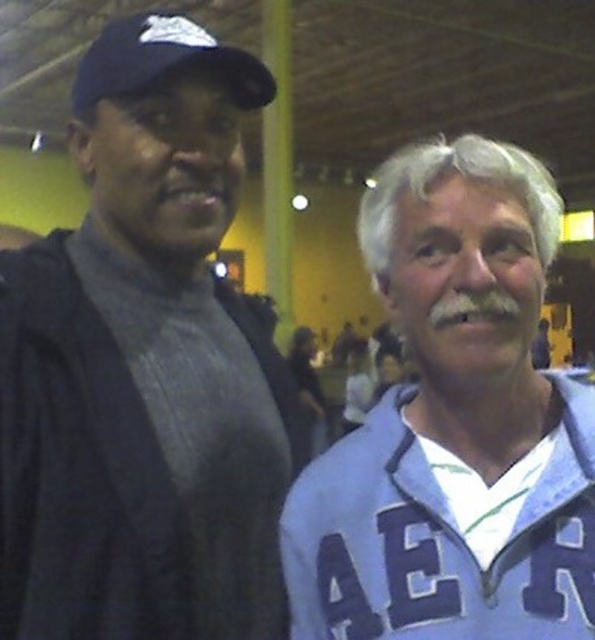
Question: Can you confirm if blue fleece jacket at right is smaller than black matte baseball cap at upper left?

Choices:
 (A) yes
 (B) no

Answer: (B)

Question: Considering the relative positions of dark gray knit sweater at left and blue fleece jacket at right in the image provided, where is dark gray knit sweater at left located with respect to blue fleece jacket at right?

Choices:
 (A) below
 (B) above

Answer: (B)

Question: Can you confirm if blue fleece jacket at right is positioned to the left of black matte baseball cap at upper left?

Choices:
 (A) yes
 (B) no

Answer: (B)

Question: Which object appears closest to the camera in this image?

Choices:
 (A) blue fleece jacket at right
 (B) dark gray knit sweater at left

Answer: (A)

Question: Which point is closer to the camera?

Choices:
 (A) black matte baseball cap at upper left
 (B) dark gray knit sweater at left

Answer: (B)

Question: Which of these objects is positioned farthest from the black matte baseball cap at upper left?

Choices:
 (A) blue fleece jacket at right
 (B) dark gray knit sweater at left

Answer: (A)